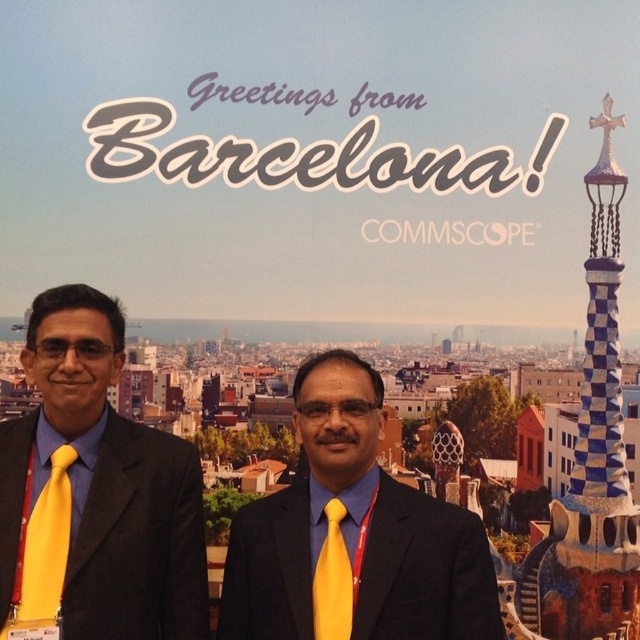
You are a fashion designer observing two items in the scene. You need to determine which item is wider between the yellow matte suit at center and the yellow satin tie at center. Which one is wider?

The yellow matte suit at center is wider than the yellow satin tie at center according to the description.

In the scene shown: You are a photographer standing at the camera position. You want to take a photo of the backdrop with the text and the Barcelona skyline. The backdrop is at point (221, 593). If your camera has a depth of field that can focus on objects up to 90 meters away, will the backdrop be in focus?

Result: The distance of point (221, 593) from the camera is 88.16 meters, which is within the camera depth of field limit of 90 meters. Therefore, the backdrop will be in focus.

In the scene shown: You are a photographer at the Barcelona backdrop. You need to adjust the lighting so that the matte black suit at left and the yellow satin tie at left are both well lit. Which object should you focus on first to ensure proper exposure?

The matte black suit at left is above the yellow satin tie at left, so you should focus on the matte black suit at left first to ensure proper exposure because it is closer to the light source.